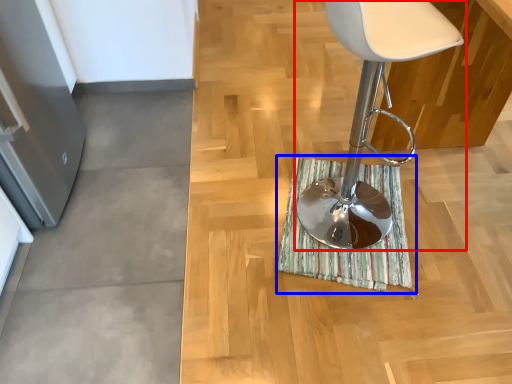
Question: Which object is further to the camera taking this photo, chair (highlighted by a red box) or bath mat (highlighted by a blue box)?

Choices:
 (A) chair
 (B) bath mat

Answer: (B)